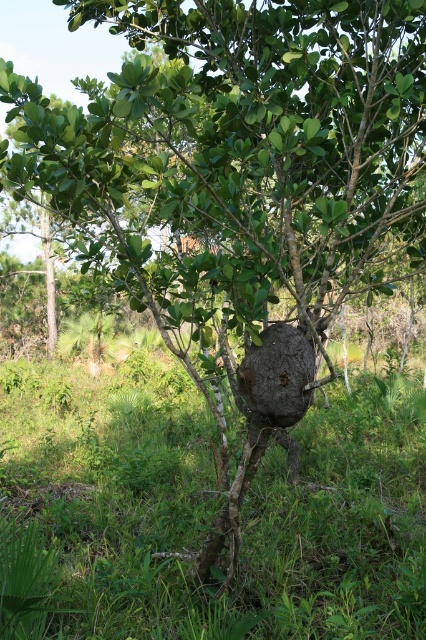
Question: Is green grass at lower center further to the viewer compared to brown rough rock at center?

Choices:
 (A) no
 (B) yes

Answer: (A)

Question: Can you confirm if green grass at lower center is positioned to the left of brown rough rock at center?

Choices:
 (A) yes
 (B) no

Answer: (A)

Question: Which point is closer to the camera?

Choices:
 (A) (x=322, y=573)
 (B) (x=273, y=342)

Answer: (B)

Question: Does green grass at lower center appear on the right side of brown rough rock at center?

Choices:
 (A) no
 (B) yes

Answer: (A)

Question: Which point is closer to the camera?

Choices:
 (A) green grass at lower center
 (B) brown rough rock at center

Answer: (A)

Question: Which point is closer to the camera?

Choices:
 (A) (279, 396)
 (B) (333, 410)

Answer: (A)